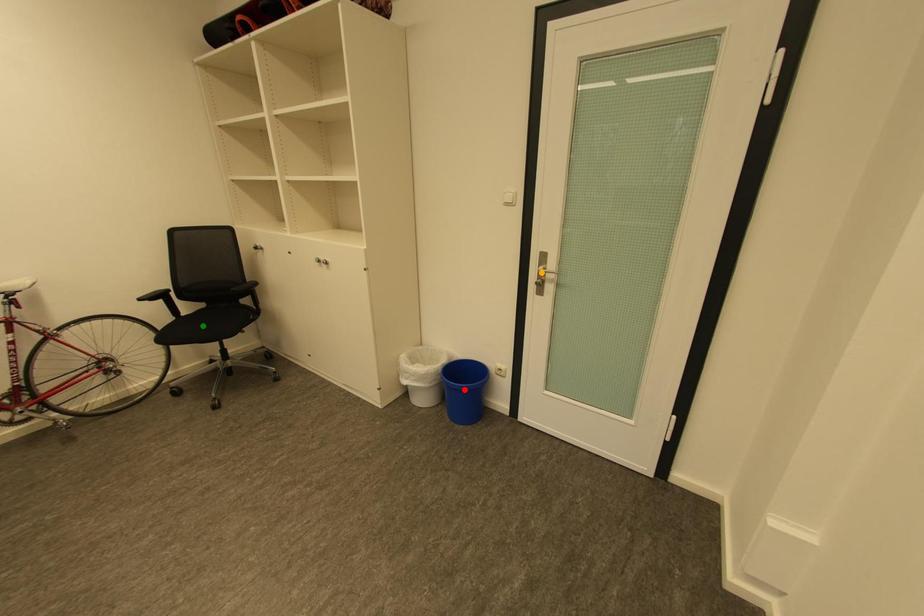
Order these from nearest to farthest:
A) red point
B) green point
C) orange point

orange point → red point → green point